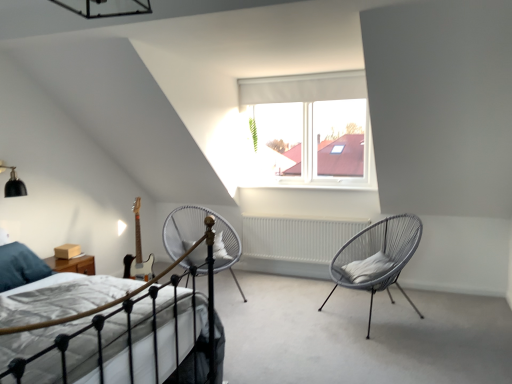
Question: Should I look upward or downward to see black matte light fixture at upper left?

Choices:
 (A) up
 (B) down

Answer: (A)

Question: Does white matte radiator at center contain white fabric bed at lower left?

Choices:
 (A) yes
 (B) no

Answer: (B)

Question: From the image's perspective, does white matte radiator at center appear higher than white fabric bed at lower left?

Choices:
 (A) yes
 (B) no

Answer: (A)

Question: Does white matte radiator at center appear on the right side of white fabric bed at lower left?

Choices:
 (A) yes
 (B) no

Answer: (A)

Question: Does white matte radiator at center have a lesser width compared to white fabric bed at lower left?

Choices:
 (A) no
 (B) yes

Answer: (B)

Question: Is the surface of white matte radiator at center in direct contact with white fabric bed at lower left?

Choices:
 (A) no
 (B) yes

Answer: (A)

Question: Considering the relative sizes of white matte radiator at center and white fabric bed at lower left in the image provided, is white matte radiator at center wider than white fabric bed at lower left?

Choices:
 (A) yes
 (B) no

Answer: (B)

Question: Is white fabric curtain at upper center inside silver metallic chair at center, which is counted as the 1th chair, starting from the left?

Choices:
 (A) yes
 (B) no

Answer: (B)

Question: Is silver metallic chair at center, which is counted as the 1th chair, starting from the left, facing towards white fabric curtain at upper center?

Choices:
 (A) yes
 (B) no

Answer: (B)

Question: Is silver metallic chair at center, which is counted as the 1th chair, starting from the left, further to the viewer compared to white fabric curtain at upper center?

Choices:
 (A) no
 (B) yes

Answer: (A)

Question: Is silver metallic chair at center, placed as the second chair when sorted from right to left, to the right of white fabric curtain at upper center from the viewer's perspective?

Choices:
 (A) yes
 (B) no

Answer: (B)

Question: Is silver metallic chair at center, which is counted as the 1th chair, starting from the left, positioned beyond the bounds of white fabric curtain at upper center?

Choices:
 (A) yes
 (B) no

Answer: (A)

Question: From the image's perspective, does silver metallic chair at center, which is counted as the 1th chair, starting from the left, appear lower than white fabric curtain at upper center?

Choices:
 (A) no
 (B) yes

Answer: (B)

Question: Does silver metallic chair at center, which is counted as the 1th chair, starting from the left, turn towards white soft pillow at right?

Choices:
 (A) yes
 (B) no

Answer: (B)